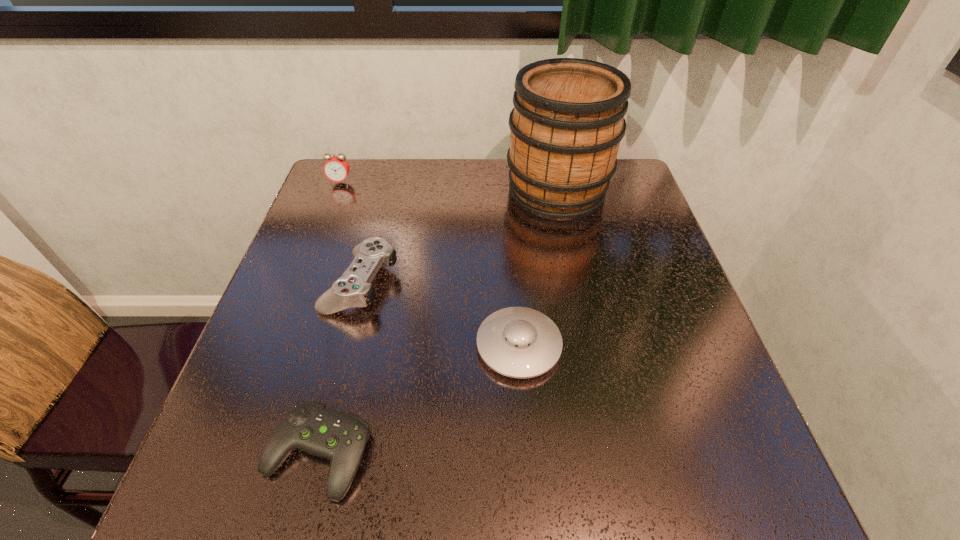
At what (x,y) coordinates should I click in order to perform the action: click on vacant position located on the back of the third shortest object. Please return your answer as a coordinate pair (x, y). Looking at the image, I should click on (374, 231).

Where is `free point located on the right of the second shortest object`? The image size is (960, 540). free point located on the right of the second shortest object is located at coordinates (636, 346).

Locate an element on the screen. free space located on the right of the nearest object is located at coordinates (576, 453).

I want to click on cider located at the far edge, so click(568, 120).

Where is `alarm clock at the far edge`? The image size is (960, 540). alarm clock at the far edge is located at coordinates (336, 168).

This screenshot has height=540, width=960. In order to click on object that is at the near edge in this screenshot , I will do `click(311, 427)`.

At what (x,y) coordinates should I click in order to perform the action: click on alarm clock located in the left edge section of the desktop. Please return your answer as a coordinate pair (x, y). This screenshot has width=960, height=540. Looking at the image, I should click on (336, 168).

Locate an element on the screen. The width and height of the screenshot is (960, 540). object present at the right edge is located at coordinates (568, 120).

This screenshot has width=960, height=540. What are the coordinates of `object at the far left corner` in the screenshot? It's located at (336, 168).

Image resolution: width=960 pixels, height=540 pixels. I want to click on object at the near left corner, so click(x=311, y=427).